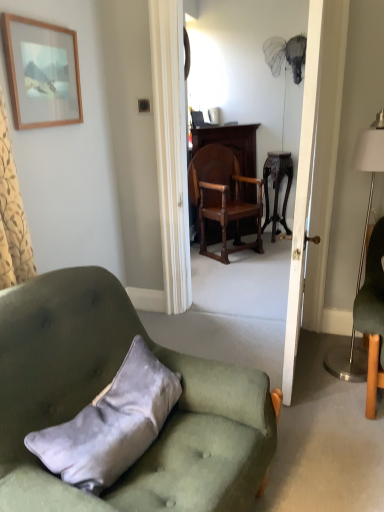
Identify the location of velvet gray pillow at lower left. The width and height of the screenshot is (384, 512). (111, 424).

What do you see at coordinates (277, 187) in the screenshot?
I see `dark wood stool at center` at bounding box center [277, 187].

The height and width of the screenshot is (512, 384). Find the location of `polished wood chair at center, acting as the 2th chair starting from the front`. polished wood chair at center, acting as the 2th chair starting from the front is located at coordinates (x=222, y=197).

Measure the distance between silver metallic floor lamp at right and camera.

A distance of 7.08 feet exists between silver metallic floor lamp at right and camera.

Locate an element on the screen. Image resolution: width=384 pixels, height=512 pixels. white wooden door at center is located at coordinates (302, 194).

Image resolution: width=384 pixels, height=512 pixels. Describe the element at coordinates (302, 194) in the screenshot. I see `white wooden door at center` at that location.

The image size is (384, 512). I want to click on velvet gray pillow at lower left, so click(x=111, y=424).

Is point (260, 244) in front of point (289, 174)?

Yes.

Does polished wood chair at center, the 1th chair viewed from the back, have a lesser height compared to dark wood stool at center?

No, polished wood chair at center, the 1th chair viewed from the back, is not shorter than dark wood stool at center.

From the picture: Is polished wood chair at center, the 1th chair viewed from the back, thinner than dark wood stool at center?

Incorrect, the width of polished wood chair at center, the 1th chair viewed from the back, is not less than that of dark wood stool at center.

From the image's perspective, is polished wood chair at center, the second chair when ordered from bottom to top, located beneath wooden picture frame at upper left?

Indeed, from the image's perspective, polished wood chair at center, the second chair when ordered from bottom to top, is shown beneath wooden picture frame at upper left.

Is polished wood chair at center, the second chair when ordered from bottom to top, not within wooden picture frame at upper left?

Yes, polished wood chair at center, the second chair when ordered from bottom to top, is not within wooden picture frame at upper left.

Based on the photo, from a real-world perspective, is polished wood chair at center, which appears as the first chair when viewed from the top, physically above wooden picture frame at upper left?

Actually, polished wood chair at center, which appears as the first chair when viewed from the top, is physically below wooden picture frame at upper left in the real world.

Which is in front, point (199, 168) or point (50, 72)?

The point (50, 72) is closer.

Is wooden picture frame at upper left touching velvet gray pillow at lower left?

wooden picture frame at upper left and velvet gray pillow at lower left are clearly separated.

Which is more to the right, wooden picture frame at upper left or velvet gray pillow at lower left?

velvet gray pillow at lower left is more to the right.

Is wooden picture frame at upper left behind velvet gray pillow at lower left?

That is True.

Between wooden picture frame at upper left and velvet gray pillow at lower left, which one has smaller size?

With smaller size is wooden picture frame at upper left.

Which object is more forward, white wooden door at center or velvet green armchair at center, arranged as the 2th chair when viewed from the back?

velvet green armchair at center, arranged as the 2th chair when viewed from the back.

From a real-world perspective, is white wooden door at center above or below velvet green armchair at center, arranged as the 2th chair when viewed from the back?

In terms of real-world spatial position, white wooden door at center is above velvet green armchair at center, arranged as the 2th chair when viewed from the back.

Are white wooden door at center and velvet green armchair at center, placed as the 1th chair when sorted from front to back, far apart?

Actually, white wooden door at center and velvet green armchair at center, placed as the 1th chair when sorted from front to back, are a little close together.

Does point (304, 131) lie behind point (18, 38)?

That is True.

How many degrees apart are the facing directions of white wooden door at center and wooden picture frame at upper left?

white wooden door at center and wooden picture frame at upper left are facing 179 degrees away from each other.

Between white wooden door at center and wooden picture frame at upper left, which one is positioned in front?

white wooden door at center is more forward.

From the image's perspective, is white wooden door at center above or below silver metallic floor lamp at right?

Clearly, from the image's perspective, white wooden door at center is above silver metallic floor lamp at right.

Does white wooden door at center lie in front of silver metallic floor lamp at right?

Yes, the depth of white wooden door at center is less than that of silver metallic floor lamp at right.

Which of these two, white wooden door at center or silver metallic floor lamp at right, stands taller?

white wooden door at center.

Image resolution: width=384 pixels, height=512 pixels. In order to click on lamp on the right side of white wooden door at center in this screenshot , I will do `click(369, 169)`.

Which is more distant, [13,352] or [294,357]?

Positioned behind is point [294,357].

Is velvet green armchair at center, arranged as the 2th chair when viewed from the back, positioned in front of white wooden door at center?

Yes, velvet green armchair at center, arranged as the 2th chair when viewed from the back, is closer to the viewer.

Is velvet green armchair at center, which appears as the first chair when ordered from the bottom, not near white wooden door at center?

velvet green armchair at center, which appears as the first chair when ordered from the bottom, is near white wooden door at center, not far away.

Where is `stool beneath the polished wood chair at center, the 1th chair viewed from the back (from a real-world perspective)`? This screenshot has height=512, width=384. stool beneath the polished wood chair at center, the 1th chair viewed from the back (from a real-world perspective) is located at coordinates (277, 187).

I want to click on picture frame lying in front of the polished wood chair at center, which appears as the first chair when viewed from the top, so click(x=41, y=73).

When comparing their distances from white wooden door at center, does silver metallic floor lamp at right or wooden picture frame at upper left seem closer?

silver metallic floor lamp at right lies closer to white wooden door at center than the other object.

From the picture: Based on their spatial positions, is wooden picture frame at upper left or white wooden door at center further from silver metallic floor lamp at right?

Among the two, wooden picture frame at upper left is located further to silver metallic floor lamp at right.

Looking at the image, which one is located further to polished wood chair at center, acting as the 2th chair starting from the front, velvet gray pillow at lower left or wooden picture frame at upper left?

The object further to polished wood chair at center, acting as the 2th chair starting from the front, is velvet gray pillow at lower left.

Estimate the real-world distances between objects in this image. Which object is further from white wooden door at center, polished wood chair at center, the second chair when ordered from bottom to top, or dark wood stool at center?

dark wood stool at center lies further to white wooden door at center than the other object.

In the scene shown: Considering their positions, is polished wood chair at center, the second chair when ordered from bottom to top, positioned further to velvet gray pillow at lower left than white wooden door at center?

The object further to velvet gray pillow at lower left is polished wood chair at center, the second chair when ordered from bottom to top.

Which object lies nearer to the anchor point silver metallic floor lamp at right, white wooden door at center or polished wood chair at center, the second chair when ordered from bottom to top?

Among the two, white wooden door at center is located nearer to silver metallic floor lamp at right.

Looking at this image, considering their positions, is white wooden door at center positioned closer to polished wood chair at center, the second chair when ordered from bottom to top, than velvet gray pillow at lower left?

Based on the image, white wooden door at center appears to be nearer to polished wood chair at center, the second chair when ordered from bottom to top.

Considering their positions, is velvet gray pillow at lower left positioned further to dark wood stool at center than wooden picture frame at upper left?

The object further to dark wood stool at center is velvet gray pillow at lower left.

Find the location of a particular element. This screenshot has height=512, width=384. door between velvet gray pillow at lower left and polished wood chair at center, the 1th chair viewed from the back, along the z-axis is located at coordinates (302, 194).

Where is `door between velvet green armchair at center, arranged as the 2th chair when viewed from the back, and polished wood chair at center, acting as the 2th chair starting from the front, in the front-back direction`? The width and height of the screenshot is (384, 512). door between velvet green armchair at center, arranged as the 2th chair when viewed from the back, and polished wood chair at center, acting as the 2th chair starting from the front, in the front-back direction is located at coordinates (302, 194).

This screenshot has width=384, height=512. What are the coordinates of `door situated between velvet gray pillow at lower left and silver metallic floor lamp at right from left to right` in the screenshot? It's located at (302, 194).

This screenshot has width=384, height=512. What are the coordinates of `door located between wooden picture frame at upper left and silver metallic floor lamp at right in the left-right direction` in the screenshot? It's located at (302, 194).